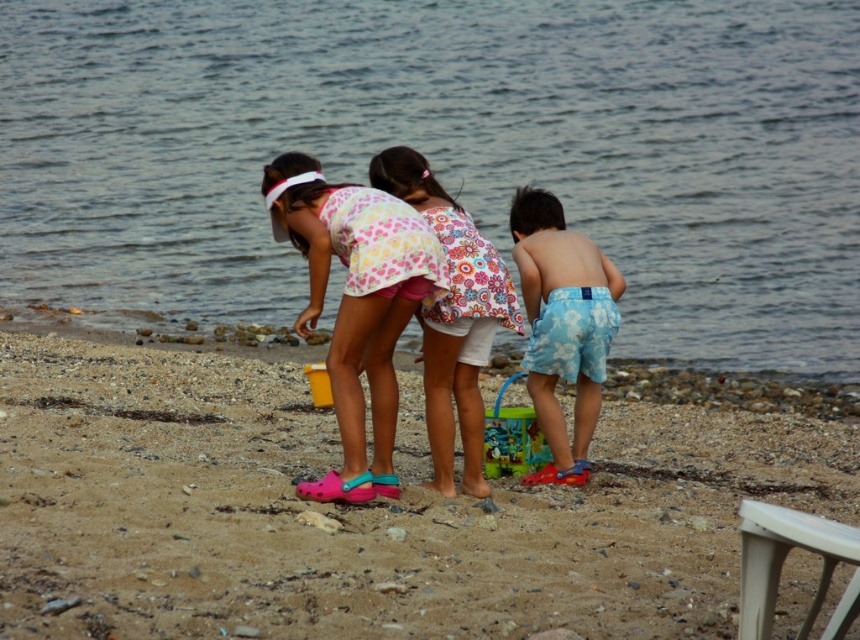
You are standing on the beach and see the pink crocs at center and the yellow plastic bucket at center. Which object is nearer to you?

The pink crocs at center are closer to the viewer than the yellow plastic bucket at center.

You are standing at the shoreline where the children are playing. You see the pink crocs at center and the yellow plastic bucket at center. If you want to pick up the bucket first, which object should you walk towards first?

The pink crocs at center and the yellow plastic bucket at center are both at center, so you can walk towards either one first since they are equidistant from your current position at the shoreline.